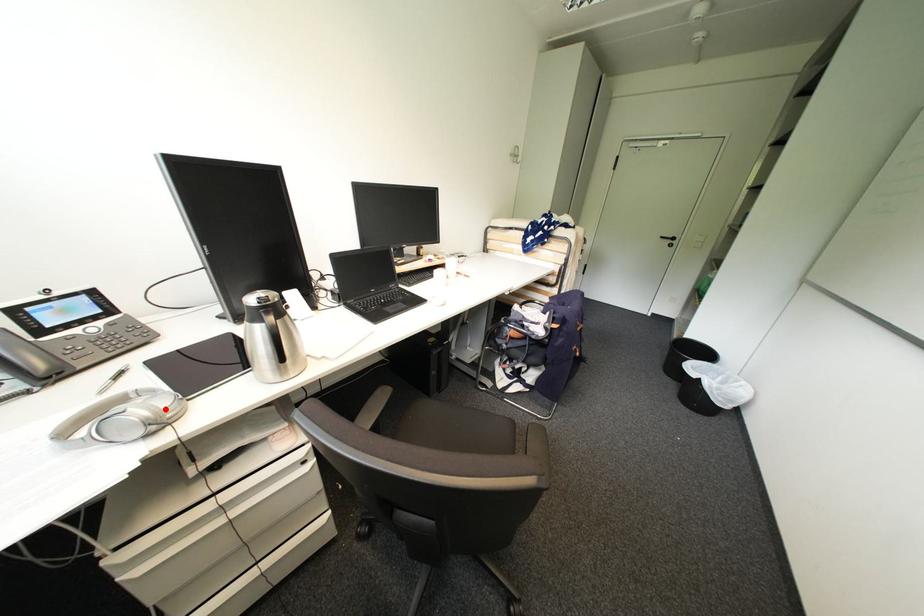
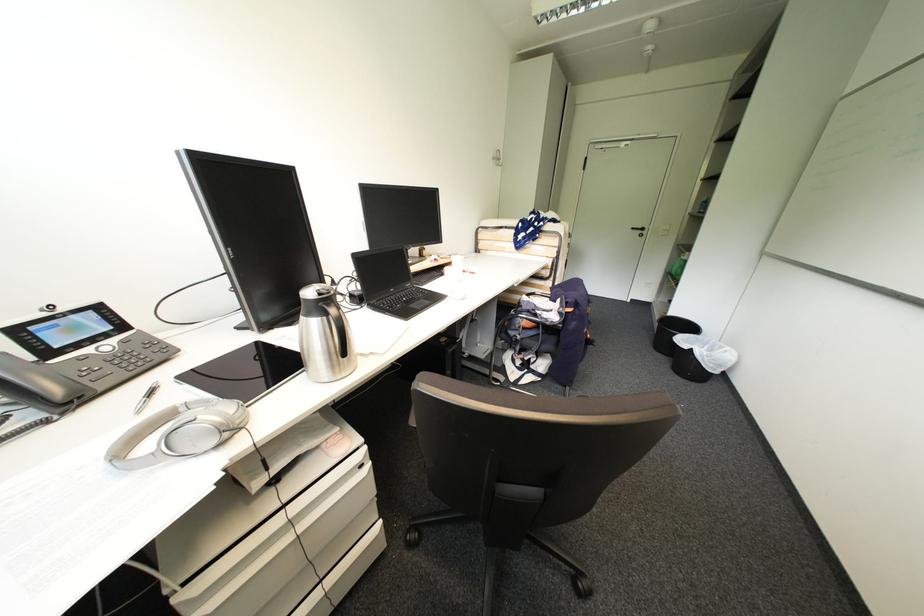
Locate, in the second image, the point that corresponds to the highlighted location in the first image.

(235, 415)